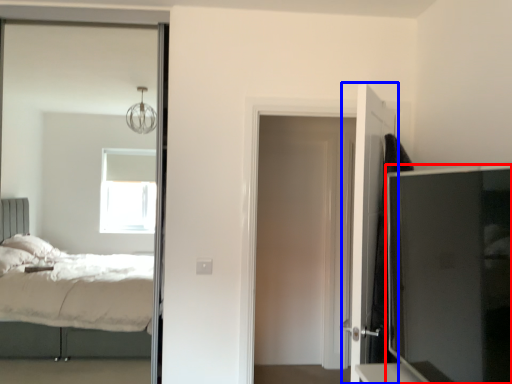
Question: Which of the following is the closest to the observer, tv cabinet (highlighted by a red box) or door (highlighted by a blue box)?

Choices:
 (A) tv cabinet
 (B) door

Answer: (A)